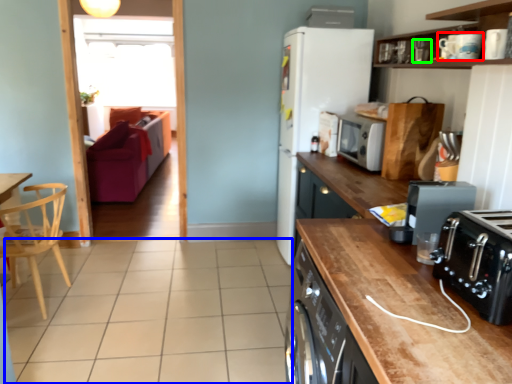
Question: Estimate the real-world distances between objects in this image. Which object is closer to appliance (highlighted by a red box), tile (highlighted by a blue box) or appliance (highlighted by a green box)?

Choices:
 (A) tile
 (B) appliance

Answer: (B)